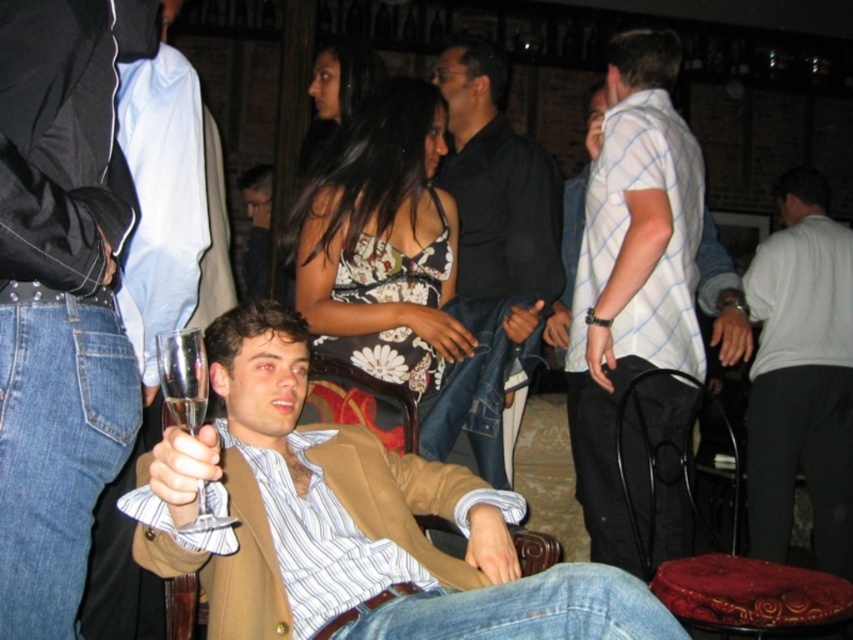
Is point (332, 120) positioned in front of point (204, 364)?

No, (332, 120) is further to viewer.

Between dark brown hair at upper center and clear glass wine glass at center, which one appears on the right side from the viewer's perspective?

Positioned to the right is clear glass wine glass at center.

Identify the location of dark brown hair at upper center. Image resolution: width=853 pixels, height=640 pixels. (337, 90).

This screenshot has width=853, height=640. Find the location of `dark brown hair at upper center`. dark brown hair at upper center is located at coordinates (337, 90).

Between point (625, 454) and point (820, 333), which one is positioned in front?

Positioned in front is point (625, 454).

Does white checkered shirt at center appear under white matte shirt at right?

Incorrect, white checkered shirt at center is not positioned below white matte shirt at right.

Locate an element on the screen. The width and height of the screenshot is (853, 640). white checkered shirt at center is located at coordinates (631, 273).

The width and height of the screenshot is (853, 640). Describe the element at coordinates (61, 296) in the screenshot. I see `light brown leather jacket at center` at that location.

Can you confirm if light brown leather jacket at center is positioned above velvet red cushion at lower right?

Correct, light brown leather jacket at center is located above velvet red cushion at lower right.

The image size is (853, 640). What do you see at coordinates (61, 296) in the screenshot?
I see `light brown leather jacket at center` at bounding box center [61, 296].

Where is `light brown leather jacket at center`? light brown leather jacket at center is located at coordinates point(61,296).